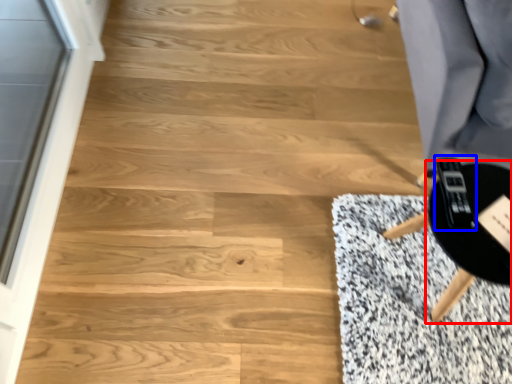
Question: Which object is closer to the camera taking this photo, round table (highlighted by a red box) or game controller (highlighted by a blue box)?

Choices:
 (A) round table
 (B) game controller

Answer: (A)